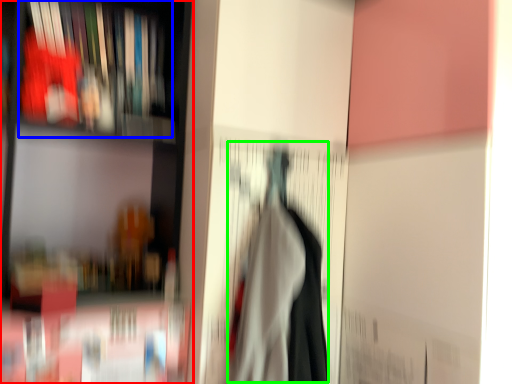
Question: Which object is positioned closest to shelf (highlighted by a red box)? Select from book (highlighted by a blue box) and woman (highlighted by a green box).

Choices:
 (A) book
 (B) woman

Answer: (A)